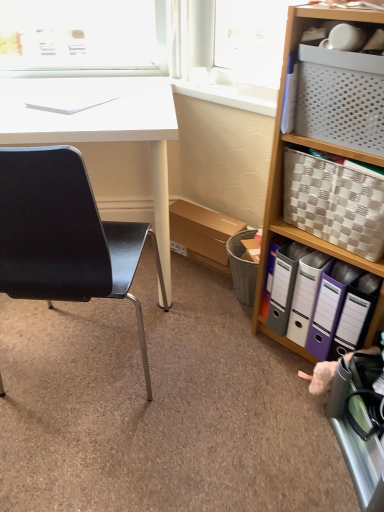
Question: Is black matte chair at left further to the viewer compared to white woven basket at right?

Choices:
 (A) yes
 (B) no

Answer: (A)

Question: Is black matte chair at left far away from white woven basket at right?

Choices:
 (A) yes
 (B) no

Answer: (B)

Question: Could you tell me if black matte chair at left is facing white woven basket at right?

Choices:
 (A) no
 (B) yes

Answer: (A)

Question: Is black matte chair at left to the left of white woven basket at right from the viewer's perspective?

Choices:
 (A) yes
 (B) no

Answer: (A)

Question: Is black matte chair at left facing away from white woven basket at right?

Choices:
 (A) yes
 (B) no

Answer: (B)

Question: From a real-world perspective, is black matte chair at left physically located above or below white plastic window sill at upper center?

Choices:
 (A) above
 (B) below

Answer: (B)

Question: In terms of size, does black matte chair at left appear bigger or smaller than white plastic window sill at upper center?

Choices:
 (A) small
 (B) big

Answer: (B)

Question: From the image's perspective, is black matte chair at left above or below white plastic window sill at upper center?

Choices:
 (A) above
 (B) below

Answer: (B)

Question: Is black matte chair at left situated inside white plastic window sill at upper center or outside?

Choices:
 (A) inside
 (B) outside

Answer: (B)

Question: Choose the correct answer: Is white glossy desk at left inside white plastic window sill at upper center or outside it?

Choices:
 (A) inside
 (B) outside

Answer: (B)

Question: Is white glossy desk at left in front of or behind white plastic window sill at upper center in the image?

Choices:
 (A) front
 (B) behind

Answer: (A)

Question: Based on their positions, is white glossy desk at left located to the left or right of white plastic window sill at upper center?

Choices:
 (A) left
 (B) right

Answer: (A)

Question: From a real-world perspective, is white glossy desk at left above or below white plastic window sill at upper center?

Choices:
 (A) below
 (B) above

Answer: (A)

Question: Based on their sizes in the image, would you say checkered fabric picnic basket at right is bigger or smaller than black matte chair at left?

Choices:
 (A) small
 (B) big

Answer: (A)

Question: Is point (294, 187) closer or farther from the camera than point (79, 173)?

Choices:
 (A) closer
 (B) farther

Answer: (B)